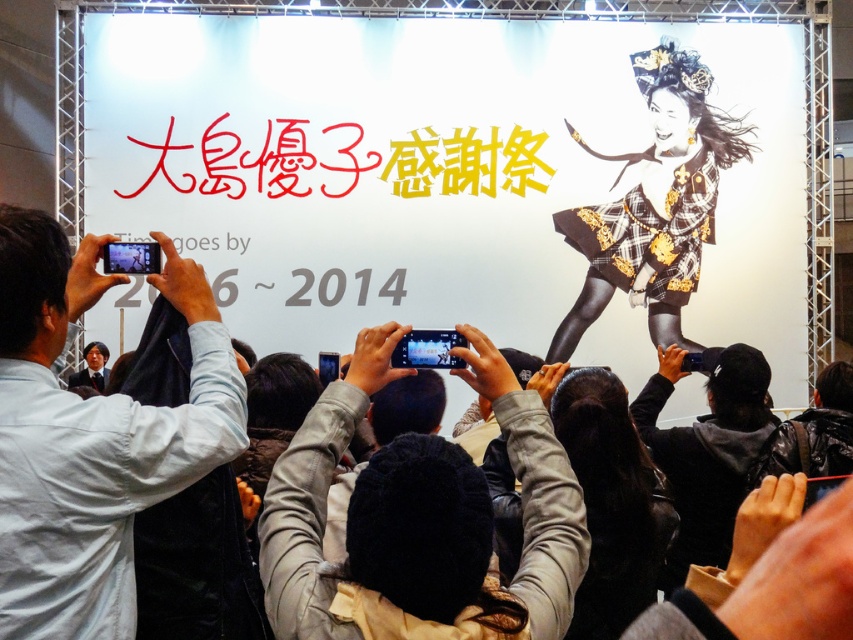
Question: Among these points, which one is nearest to the camera?

Choices:
 (A) (380, 502)
 (B) (51, 412)

Answer: (A)

Question: Considering the relative positions of matte black dress at upper right and black leather jacket at lower right in the image provided, where is matte black dress at upper right located with respect to black leather jacket at lower right?

Choices:
 (A) left
 (B) right

Answer: (A)

Question: Which of the following is the closest to the observer?

Choices:
 (A) white shirt at left
 (B) leather jacket at center

Answer: (B)

Question: Which object appears closest to the camera in this image?

Choices:
 (A) white shirt at left
 (B) leather jacket at center
 (C) black leather jacket at lower right

Answer: (B)

Question: Does matte black dress at upper right appear over black leather jacket at lower right?

Choices:
 (A) yes
 (B) no

Answer: (A)

Question: Does matte black dress at upper right lie behind leather jacket at center?

Choices:
 (A) yes
 (B) no

Answer: (A)